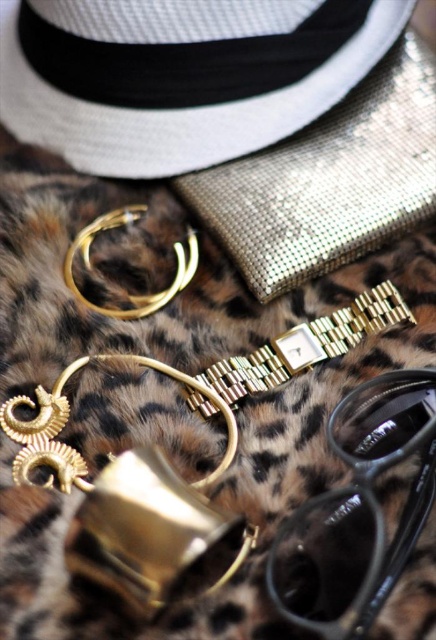
Question: Is white woven hat at upper left smaller than black plastic goggles at lower right?

Choices:
 (A) no
 (B) yes

Answer: (A)

Question: Is white woven hat at upper left wider than black plastic goggles at lower right?

Choices:
 (A) yes
 (B) no

Answer: (A)

Question: Does white woven hat at upper left have a lesser width compared to black plastic goggles at lower right?

Choices:
 (A) no
 (B) yes

Answer: (A)

Question: Which point is closer to the camera?

Choices:
 (A) (23, 128)
 (B) (409, 500)

Answer: (B)

Question: Which point is closer to the camera taking this photo?

Choices:
 (A) (384, 445)
 (B) (96, 80)

Answer: (A)